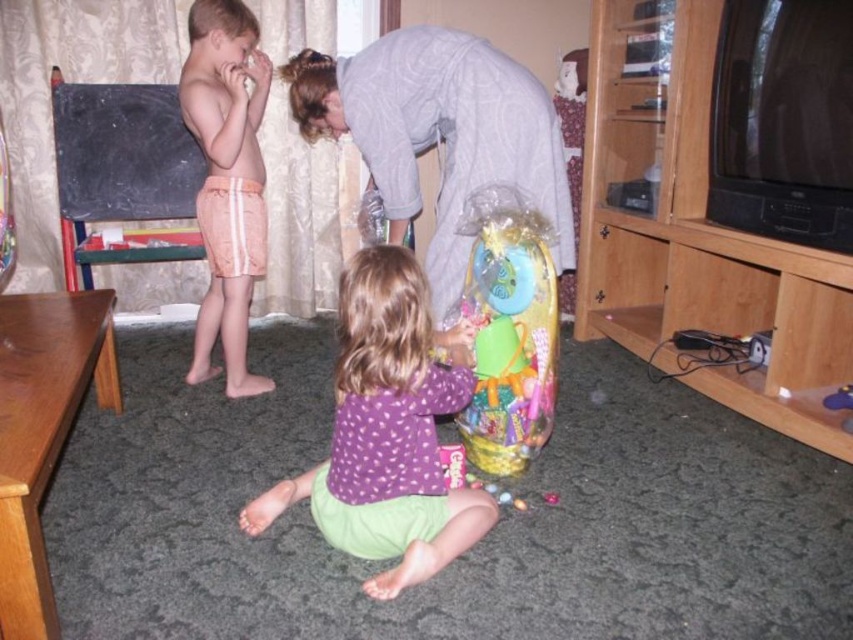
You are standing in the living room and want to take a photo of the point at coordinate (456,67). The camera requires the subject to be at least 10 feet away to avoid blurring. Is the point too close?

The point at coordinate (456,67) is only 8.01 feet from the camera, which is closer than the required 10 feet. Taking the photo may result in blurring.

You are planning to hang a picture frame that is 1.2 meters wide on the wall between the gray cotton shirt at upper center and the pink striped shorts at left. Based on the description, will the space between them be sufficient to fit the frame?

The gray cotton shirt at upper center might be wider than the pink striped shorts at left, but without exact measurements, it is uncertain if the space between them can accommodate a 1.2 meter wide picture frame. Further information is needed to determine this.

You are a delivery person who needs to place a package that is 1.2 meters long between the pink striped shorts at left and the translucent plastic basket at center. Is there enough space to place the package between them?

The distance between the pink striped shorts at left and the translucent plastic basket at center is 1.03 meters, which is shorter than the package length of 1.2 meters. Therefore, there is not enough space to place the package between them.